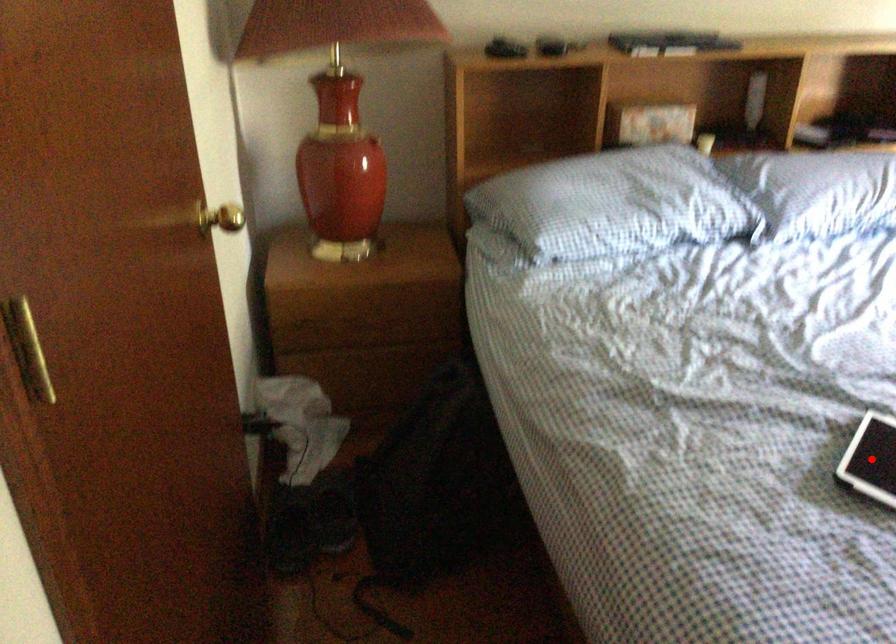
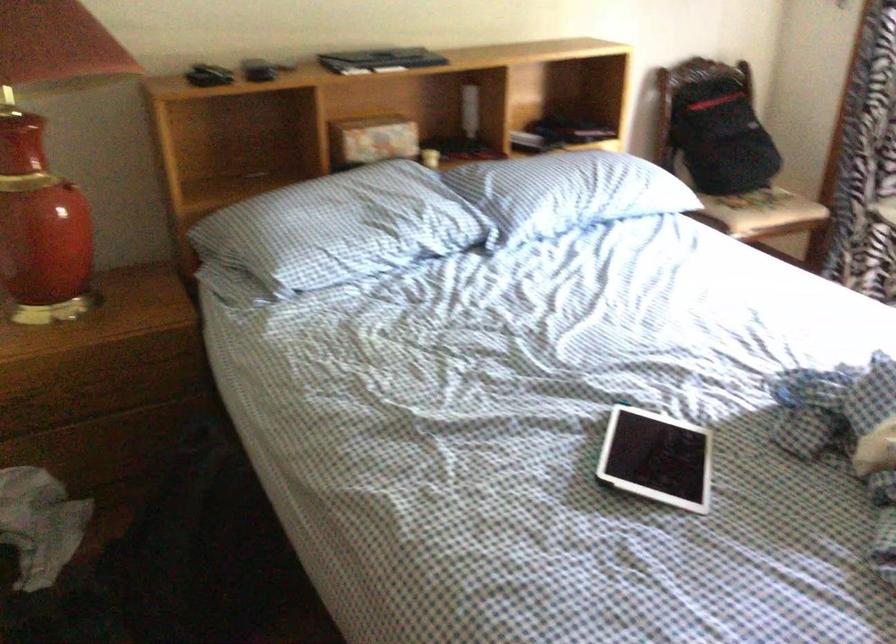
Question: I am providing you with two images of the same scene from different viewpoints. A red point is marked on the first image. Can you still see the location of the red point in image 2?

Choices:
 (A) Yes
 (B) No

Answer: (B)